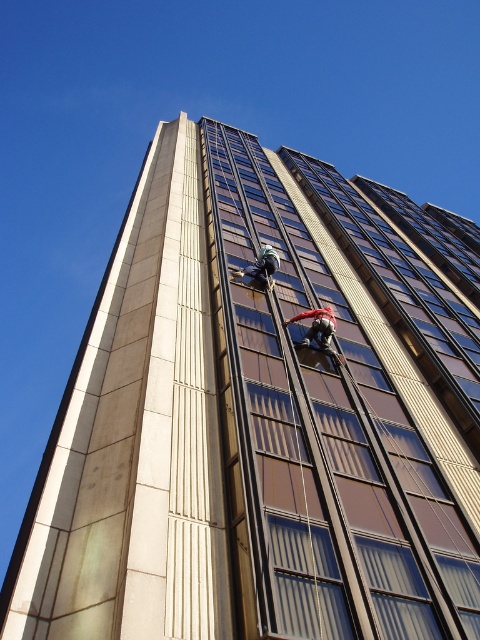
You are standing on the ground looking up at the building. Which of the two workers, the red helmeted worker at center or the metallic helmet at center, appears to be nearer to you?

The red helmeted worker at center appears closer to you because they are positioned nearer in the scene compared to the metallic helmet at center.

From the picture: You are a safety inspector standing at the camera position. You need to inspect a specific point on the building marked at coordinates point [331,332]. Your inspection tool has a maximum reach of 15 meters. Can your tool reach that point?

The distance between point [331,332] and the camera is 17.44 meters, which exceeds the tool reach of 15 meters. Therefore, the tool cannot reach the point.